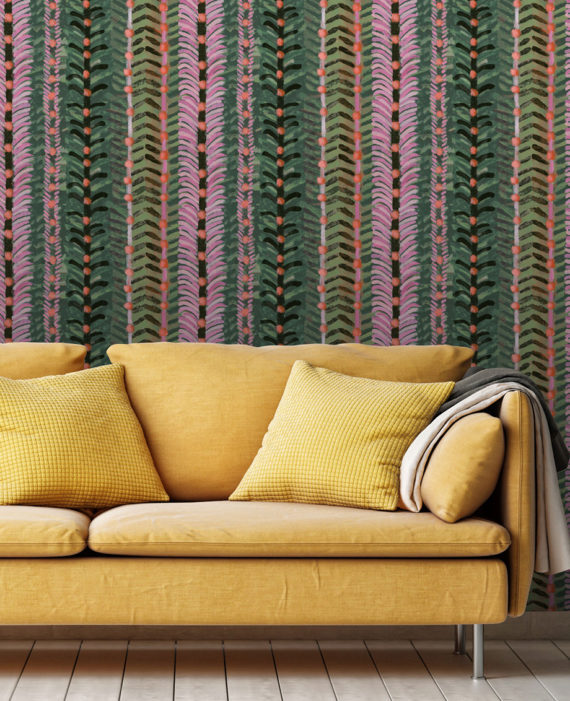
The image size is (570, 701). Identify the location of seat cushion. (193, 508), (48, 531).